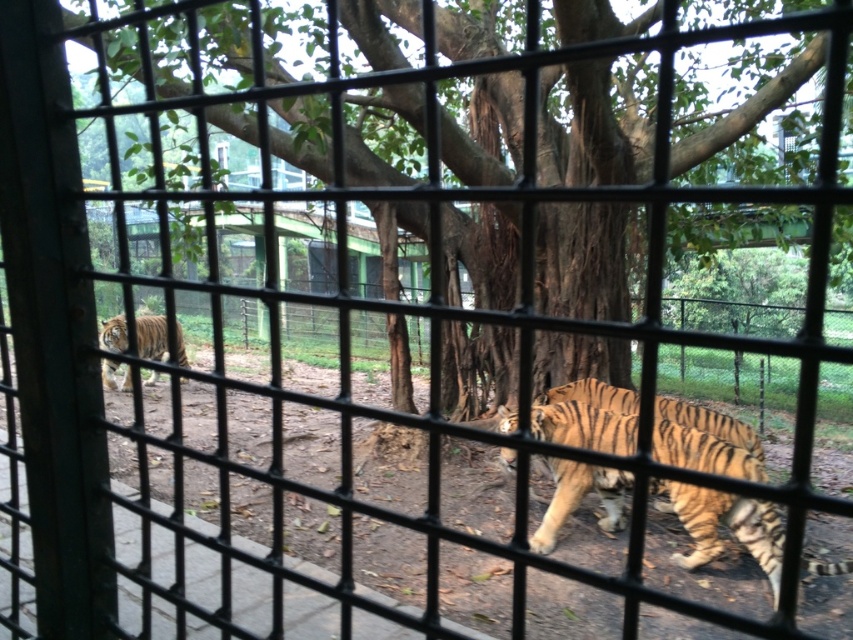
You are a zookeeper trying to observe the tigers through the metal grid fence. You notice two orange striped tigers in the enclosure. Which one is positioned closer to the fence, the orange striped tiger at center or the orange striped tiger at left?

The orange striped tiger at center is closer to the viewer than the orange striped tiger at left, so the orange striped tiger at center is positioned closer to the fence.

You are a zookeeper planning to distribute food equally to all tigers in the enclosure. Given that the orange striped tiger at center and the orange striped tiger at left are visible through the fence, which tiger requires a larger portion of food based on their apparent size?

The orange striped tiger at left requires a larger portion of food because it occupies more space than the orange striped tiger at center, indicating it is larger in size.